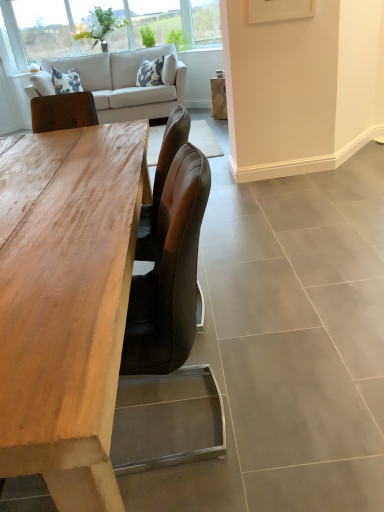
Where is `vacant area on top of wooden table at center (from a real-world perspective)`? vacant area on top of wooden table at center (from a real-world perspective) is located at coordinates (56, 185).